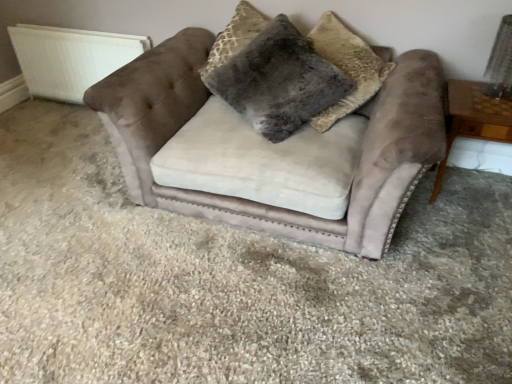
Where is `blank space situated above white textured radiator at upper left (from a real-world perspective)`? The height and width of the screenshot is (384, 512). blank space situated above white textured radiator at upper left (from a real-world perspective) is located at coordinates (74, 34).